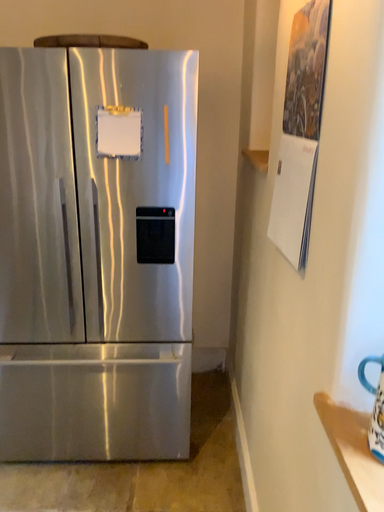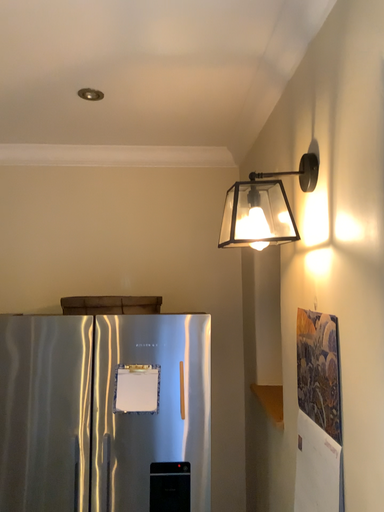
Question: How did the camera likely rotate when shooting the video?

Choices:
 (A) rotated downward
 (B) rotated upward

Answer: (B)